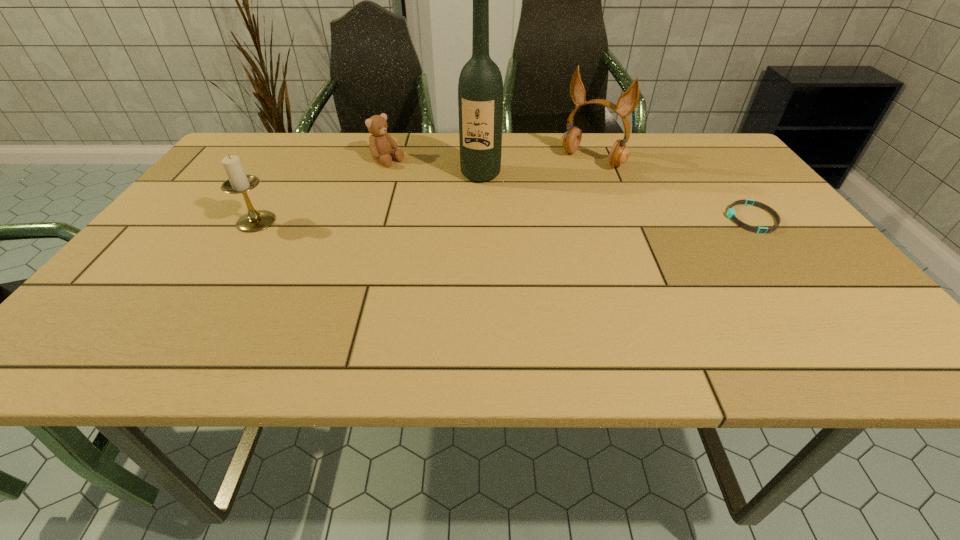
Where is `free space between the rightmost object and the candle holder`? free space between the rightmost object and the candle holder is located at coordinates (504, 220).

Locate an element on the screen. The height and width of the screenshot is (540, 960). free space between the tallest object and the candle holder is located at coordinates (369, 198).

You are a GUI agent. You are given a task and a screenshot of the screen. Output one action in this format:
    pyautogui.click(x=<x>, y=<y>)
    Task: Click on the object that stands as the second closest to the third tallest object
    
    Given the screenshot: What is the action you would take?
    pyautogui.click(x=480, y=88)

Select which object is the fourth closest to the earphone. Please provide its 2D coordinates. Your answer should be formatted as a tuple, i.e. [(x, y)], where the tuple contains the x and y coordinates of a point satisfying the conditions above.

[(238, 182)]

Locate an element on the screen. This screenshot has height=540, width=960. vacant area in the image that satisfies the following two spatial constraints: 1. on the back side of the tallest object; 2. on the left side of the second tallest object is located at coordinates (481, 160).

Find the location of `blank space that satisfies the following two spatial constraints: 1. on the back side of the fourth tallest object; 2. on the left side of the earphone`. blank space that satisfies the following two spatial constraints: 1. on the back side of the fourth tallest object; 2. on the left side of the earphone is located at coordinates (389, 160).